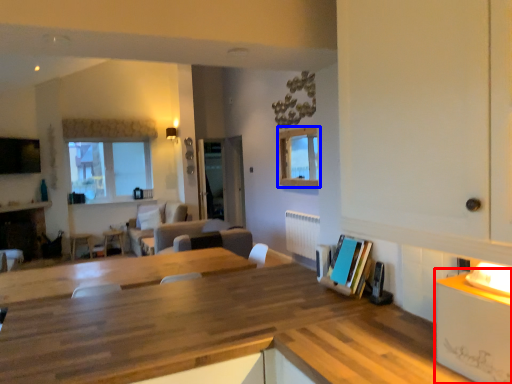
Question: Which of the following is the farthest to the observer, counter (highlighted by a red box) or window (highlighted by a blue box)?

Choices:
 (A) counter
 (B) window

Answer: (B)